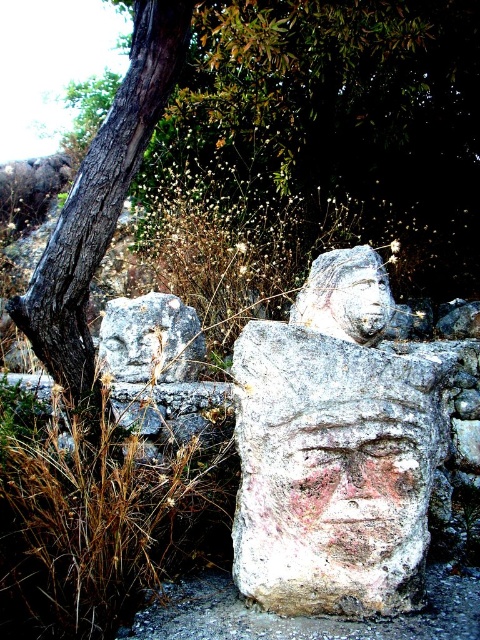
Who is shorter, rough stone head at center or smooth stone face at center?

smooth stone face at center is shorter.

Who is lower down, rough stone head at center or smooth stone face at center?

rough stone head at center

Is point (383, 266) farther from camera compared to point (381, 296)?

Yes, point (383, 266) is behind point (381, 296).

Find the location of `rough stone head at center`. rough stone head at center is located at coordinates (346, 296).

Does brown grass at center appear under carved stone face at center?

Actually, brown grass at center is above carved stone face at center.

Who is more distant from viewer, (38, 518) or (407, 413)?

The point (407, 413) is behind.

This screenshot has height=640, width=480. Find the location of `brown grass at center`. brown grass at center is located at coordinates (100, 509).

Which of these two, carved stone face at center or smooth stone face at center, stands taller?

Standing taller between the two is carved stone face at center.

Is carved stone face at center above smooth stone face at center?

No, carved stone face at center is not above smooth stone face at center.

Describe the element at coordinates (354, 483) in the screenshot. Image resolution: width=480 pixels, height=640 pixels. I see `carved stone face at center` at that location.

Locate an element on the screen. carved stone face at center is located at coordinates 354,483.